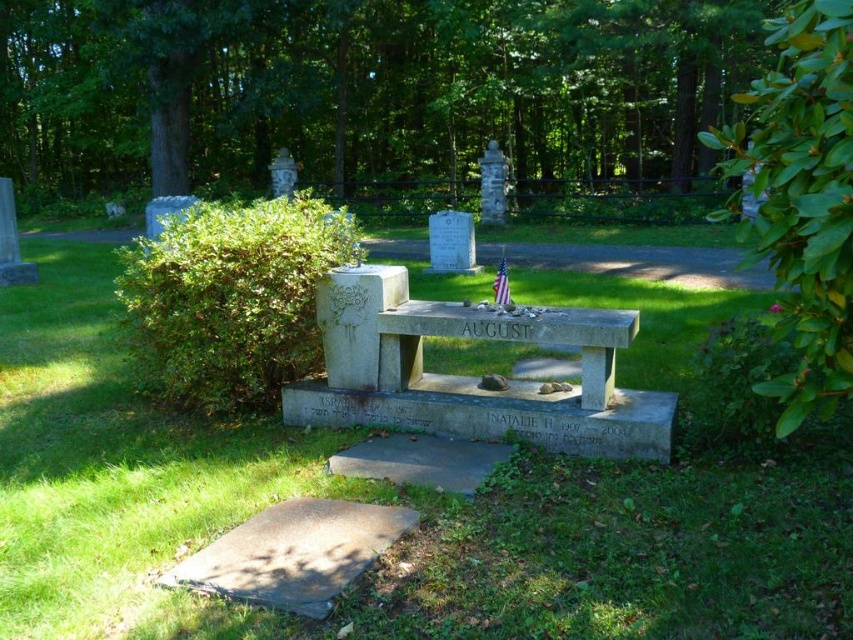
Question: Does green leafy bush at left appear on the right side of green leafy bush at right?

Choices:
 (A) yes
 (B) no

Answer: (B)

Question: Which of the following is the farthest from the observer?

Choices:
 (A) green leafy bush at center
 (B) green leafy bush at right
 (C) green grass at center

Answer: (A)

Question: Does green leafy bush at center have a lesser width compared to green leafy bush at right?

Choices:
 (A) yes
 (B) no

Answer: (B)

Question: Is green grass at center to the left of smooth gray stone bench at center from the viewer's perspective?

Choices:
 (A) no
 (B) yes

Answer: (B)

Question: Which of these objects is positioned closest to the green leafy bush at center?

Choices:
 (A) smooth gray stone bench at center
 (B) green leafy bush at right
 (C) green leafy bush at left
 (D) green grass at center

Answer: (B)

Question: Which of the following is the farthest from the observer?

Choices:
 (A) green leafy bush at left
 (B) green grass at center
 (C) green leafy bush at right

Answer: (A)